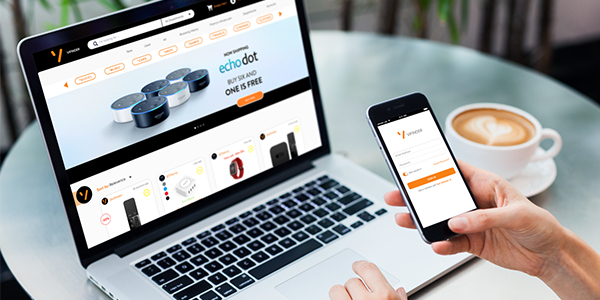
Locate an element on the screen. blinds is located at coordinates (549, 34), (520, 32), (491, 30), (413, 20), (389, 15), (352, 19), (12, 19), (72, 6).